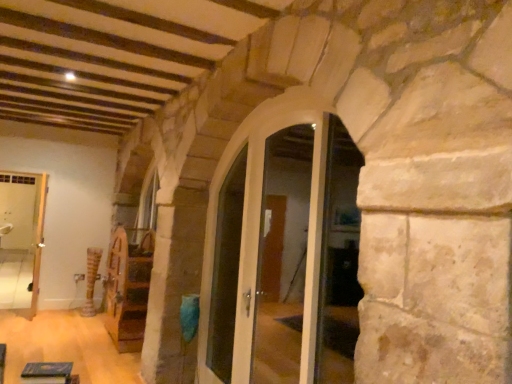
Question: Does white glossy door at center, marked as the 2th glass door in a front-to-back arrangement, have a lesser height compared to clear glass door at center, which ranks as the second glass door in back-to-front order?

Choices:
 (A) no
 (B) yes

Answer: (B)

Question: Is white glossy door at center, marked as the 2th glass door in a front-to-back arrangement, aimed at clear glass door at center, which appears as the 1th glass door when viewed from the front?

Choices:
 (A) yes
 (B) no

Answer: (A)

Question: Can you confirm if white glossy door at center, marked as the 2th glass door in a front-to-back arrangement, is smaller than clear glass door at center, which appears as the 1th glass door when viewed from the front?

Choices:
 (A) no
 (B) yes

Answer: (B)

Question: Is white glossy door at center, marked as the 2th glass door in a front-to-back arrangement, bigger than clear glass door at center, which appears as the 1th glass door when viewed from the front?

Choices:
 (A) yes
 (B) no

Answer: (B)

Question: Is clear glass door at center, which appears as the 1th glass door when viewed from the front, a part of white glossy door at center, marked as the 2th glass door in a front-to-back arrangement?

Choices:
 (A) yes
 (B) no

Answer: (A)

Question: From a real-world perspective, is clear glass door at center, which ranks as the second glass door in back-to-front order, positioned above or below green felt book at lower left, the first furniture positioned from the front?

Choices:
 (A) below
 (B) above

Answer: (B)

Question: Would you say clear glass door at center, which ranks as the second glass door in back-to-front order, is to the left or to the right of green felt book at lower left, the second furniture when ordered from back to front, in the picture?

Choices:
 (A) left
 (B) right

Answer: (B)

Question: Is point (356, 264) closer or farther from the camera than point (31, 382)?

Choices:
 (A) closer
 (B) farther

Answer: (B)

Question: Is clear glass door at center, which ranks as the second glass door in back-to-front order, spatially inside green felt book at lower left, the first furniture positioned from the front, or outside of it?

Choices:
 (A) outside
 (B) inside

Answer: (A)

Question: In terms of size, does wooden textured pillar at center appear bigger or smaller than white glossy door at left?

Choices:
 (A) big
 (B) small

Answer: (B)

Question: From a real-world perspective, relative to white glossy door at left, is wooden textured pillar at center vertically above or below?

Choices:
 (A) above
 (B) below

Answer: (B)

Question: Considering the positions of wooden textured pillar at center and white glossy door at left in the image, is wooden textured pillar at center taller or shorter than white glossy door at left?

Choices:
 (A) short
 (B) tall

Answer: (A)

Question: Considering the positions of wooden textured pillar at center and white glossy door at left in the image, is wooden textured pillar at center wider or thinner than white glossy door at left?

Choices:
 (A) thin
 (B) wide

Answer: (B)

Question: From the image's perspective, is wooden spinning wheel at center, which is counted as the second furniture, starting from the front, above or below white glossy door at center?

Choices:
 (A) above
 (B) below

Answer: (B)

Question: Is point (113, 304) closer or farther from the camera than point (219, 350)?

Choices:
 (A) farther
 (B) closer

Answer: (A)